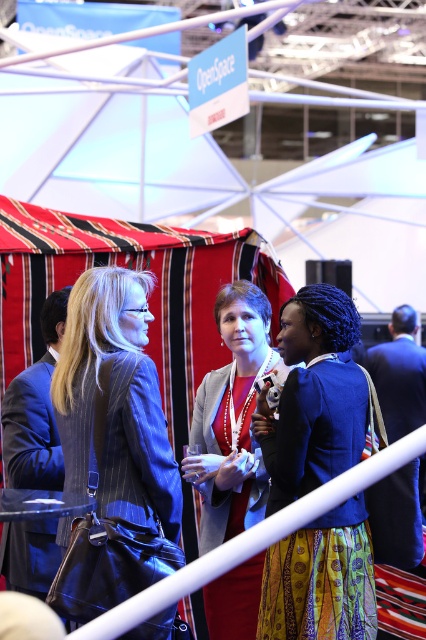
Question: Is blue pinstripe blazer at center in front of matte gray blazer at center?

Choices:
 (A) no
 (B) yes

Answer: (B)

Question: Which object is the farthest from the blue fabric jacket at center?

Choices:
 (A) blue pinstripe blazer at center
 (B) matte gray blazer at center

Answer: (A)

Question: Is blue fabric jacket at center further to the viewer compared to matte gray blazer at center?

Choices:
 (A) no
 (B) yes

Answer: (A)

Question: Which point appears farthest from the camera in this image?

Choices:
 (A) (215, 428)
 (B) (152, 554)
 (C) (281, 621)

Answer: (A)

Question: Can you confirm if blue fabric jacket at center is positioned to the left of matte gray blazer at center?

Choices:
 (A) no
 (B) yes

Answer: (A)

Question: Which of these objects is positioned farthest from the blue pinstripe blazer at center?

Choices:
 (A) matte gray blazer at center
 (B) blue fabric jacket at center

Answer: (A)